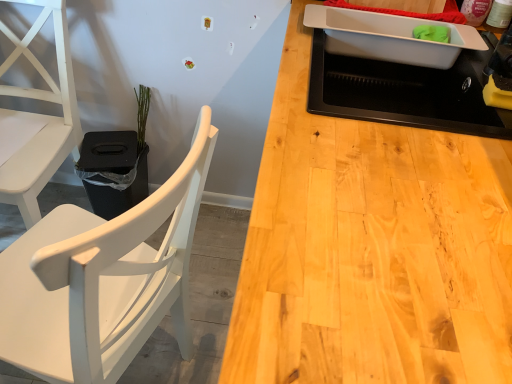
Question: Can you confirm if black matte sink at upper right is thinner than white matte chair at left, the first chair positioned from the left?

Choices:
 (A) yes
 (B) no

Answer: (A)

Question: From the image's perspective, does black matte sink at upper right appear higher than white matte chair at left, which ranks as the 2th chair in right-to-left order?

Choices:
 (A) no
 (B) yes

Answer: (B)

Question: Is black matte sink at upper right at the right side of white matte chair at left, which ranks as the 2th chair in right-to-left order?

Choices:
 (A) no
 (B) yes

Answer: (B)

Question: Is black matte sink at upper right taller than white matte chair at left, the first chair positioned from the left?

Choices:
 (A) yes
 (B) no

Answer: (B)

Question: Is there a large distance between black matte sink at upper right and white matte chair at left, which ranks as the 2th chair in right-to-left order?

Choices:
 (A) no
 (B) yes

Answer: (B)

Question: Would you say black matte sink at upper right contains white matte chair at left, the first chair positioned from the left?

Choices:
 (A) no
 (B) yes

Answer: (A)

Question: Could white plastic tray at upper right be considered to be inside white matte chair at left, the first chair positioned from the left?

Choices:
 (A) yes
 (B) no

Answer: (B)

Question: Considering the relative sizes of white matte chair at left, the first chair positioned from the left, and white plastic tray at upper right in the image provided, is white matte chair at left, the first chair positioned from the left, thinner than white plastic tray at upper right?

Choices:
 (A) no
 (B) yes

Answer: (A)

Question: From a real-world perspective, is white matte chair at left, the first chair positioned from the left, below white plastic tray at upper right?

Choices:
 (A) yes
 (B) no

Answer: (A)

Question: Can you confirm if white matte chair at left, which ranks as the 2th chair in right-to-left order, is smaller than white plastic tray at upper right?

Choices:
 (A) yes
 (B) no

Answer: (B)

Question: Is white matte chair at left, which ranks as the 2th chair in right-to-left order, closer to camera compared to white plastic tray at upper right?

Choices:
 (A) no
 (B) yes

Answer: (B)

Question: Is white matte chair at left, which ranks as the 2th chair in right-to-left order, further to camera compared to white plastic tray at upper right?

Choices:
 (A) yes
 (B) no

Answer: (B)

Question: Considering the relative sizes of green matte plant at upper left and black plastic houseplant at left in the image provided, is green matte plant at upper left thinner than black plastic houseplant at left?

Choices:
 (A) yes
 (B) no

Answer: (A)